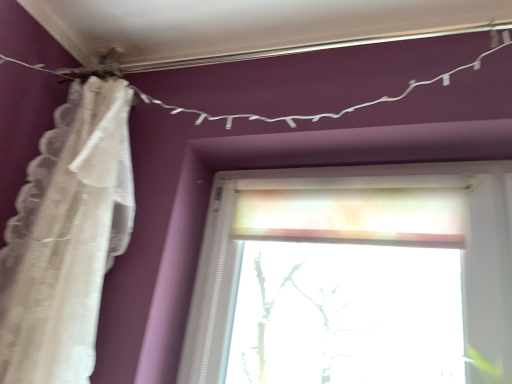
Describe the element at coordinates (67, 237) in the screenshot. I see `white lace curtain at left` at that location.

The image size is (512, 384). Find the location of `white lace curtain at left`. white lace curtain at left is located at coordinates (67, 237).

Measure the distance between point (72, 143) and camera.

A distance of 38.66 inches exists between point (72, 143) and camera.

This screenshot has height=384, width=512. What are the coordinates of `white string lights at upper center` in the screenshot? It's located at (325, 113).

The width and height of the screenshot is (512, 384). What do you see at coordinates (325, 113) in the screenshot? I see `white string lights at upper center` at bounding box center [325, 113].

Where is `white lace curtain at left`? This screenshot has height=384, width=512. white lace curtain at left is located at coordinates (67, 237).

Which object is positioned more to the right, white lace curtain at left or white string lights at upper center?

white string lights at upper center is more to the right.

Is the position of white lace curtain at left more distant than that of white string lights at upper center?

No, the depth of white lace curtain at left is less than that of white string lights at upper center.

Which is in front, point (117, 174) or point (371, 102)?

The point (117, 174) is more forward.

From the image's perspective, is white lace curtain at left beneath white string lights at upper center?

Yes, from the image's perspective, white lace curtain at left is below white string lights at upper center.

From a real-world perspective, is white lace curtain at left physically below white string lights at upper center?

Yes, from a real-world perspective, white lace curtain at left is below white string lights at upper center.

Consider the image. Considering the relative sizes of white lace curtain at left and white string lights at upper center in the image provided, is white lace curtain at left wider than white string lights at upper center?

Indeed, white lace curtain at left has a greater width compared to white string lights at upper center.

In terms of height, does white lace curtain at left look taller or shorter compared to white string lights at upper center?

Considering their sizes, white lace curtain at left has more height than white string lights at upper center.

Based on their sizes in the image, would you say white lace curtain at left is bigger or smaller than white string lights at upper center?

In the image, white lace curtain at left appears to be larger than white string lights at upper center.

Does white lace curtain at left contain white string lights at upper center?

That's incorrect, white string lights at upper center is not inside white lace curtain at left.

Is white lace curtain at left next to white string lights at upper center and touching it?

They are not placed beside each other.

Is white lace curtain at left oriented away from white string lights at upper center?

No, white lace curtain at left's orientation is not away from white string lights at upper center.

Can you tell me how much white lace curtain at left and white string lights at upper center differ in facing direction?

white lace curtain at left and white string lights at upper center are facing 0.0203 degrees away from each other.

What are the coordinates of `curtain that is under the white string lights at upper center (from a real-world perspective)` in the screenshot? It's located at (67, 237).

In the scene shown: Which object is positioned more to the left, white string lights at upper center or white lace curtain at left?

white lace curtain at left is more to the left.

Considering their positions, is white string lights at upper center located in front of or behind white lace curtain at left?

Visually, white string lights at upper center is located behind white lace curtain at left.

Is point (411, 91) farther from viewer compared to point (108, 112)?

No, it is not.

From the image's perspective, which is above, white string lights at upper center or white lace curtain at left?

white string lights at upper center.

From a real-world perspective, who is located lower, white string lights at upper center or white lace curtain at left?

white lace curtain at left is physically lower.

Which of these two, white string lights at upper center or white lace curtain at left, is thinner?

With smaller width is white string lights at upper center.

Which of these two, white string lights at upper center or white lace curtain at left, stands shorter?

Standing shorter between the two is white string lights at upper center.

From the picture: Which of these two, white string lights at upper center or white lace curtain at left, is smaller?

white string lights at upper center is smaller.

Is white string lights at upper center not inside white lace curtain at left?

Indeed, white string lights at upper center is completely outside white lace curtain at left.

Is there a large distance between white string lights at upper center and white lace curtain at left?

Actually, white string lights at upper center and white lace curtain at left are a little close together.

Is white string lights at upper center facing away from white lace curtain at left?

That's not correct — white string lights at upper center is not looking away from white lace curtain at left.

The image size is (512, 384). What are the coordinates of `curtain in front of the white string lights at upper center` in the screenshot? It's located at (67, 237).

You are a GUI agent. You are given a task and a screenshot of the screen. Output one action in this format:
    pyautogui.click(x=<x>, y=<y>)
    Task: Click on the clothesline behind the white lace curtain at left
    
    Given the screenshot: What is the action you would take?
    pyautogui.click(x=325, y=113)

What are the coordinates of `curtain lying below the white string lights at upper center (from the image's perspective)` in the screenshot? It's located at (67, 237).